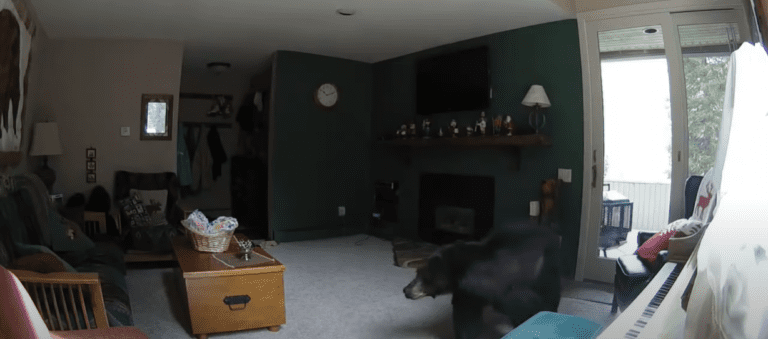
This screenshot has height=339, width=768. What are the coordinates of `empty space on floor` in the screenshot? It's located at (315, 298), (330, 246), (398, 312), (151, 308), (586, 308).